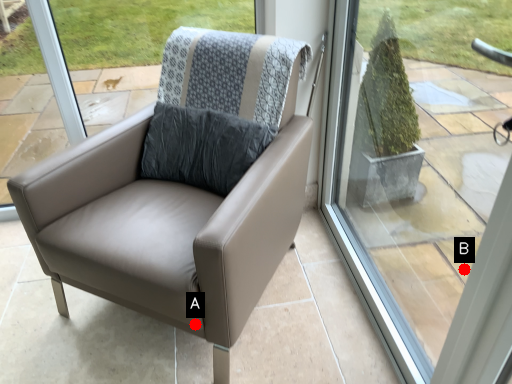
Question: Two points are circled on the image, labeled by A and B beside each circle. Which point appears farthest from the camera in this image?

Choices:
 (A) A is further
 (B) B is further

Answer: (B)